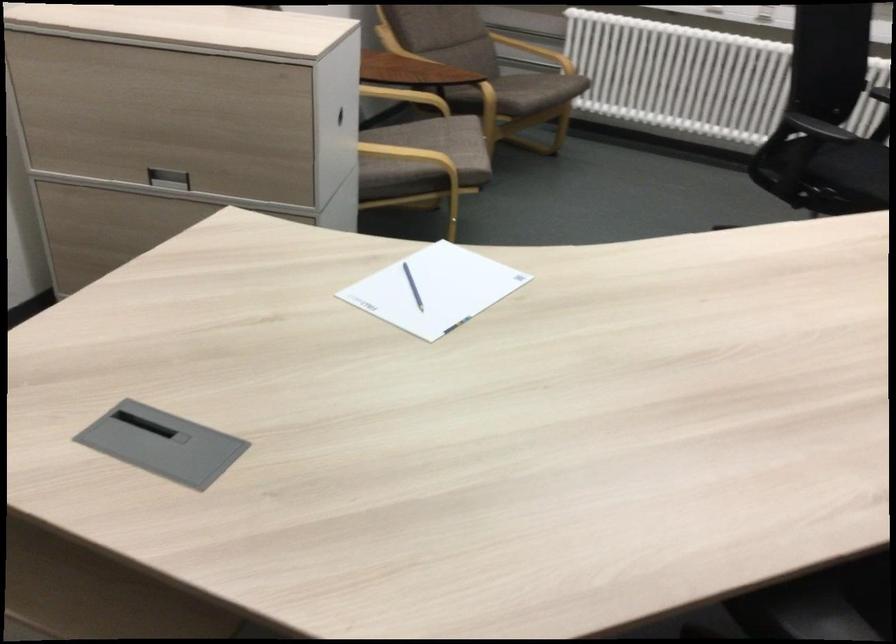
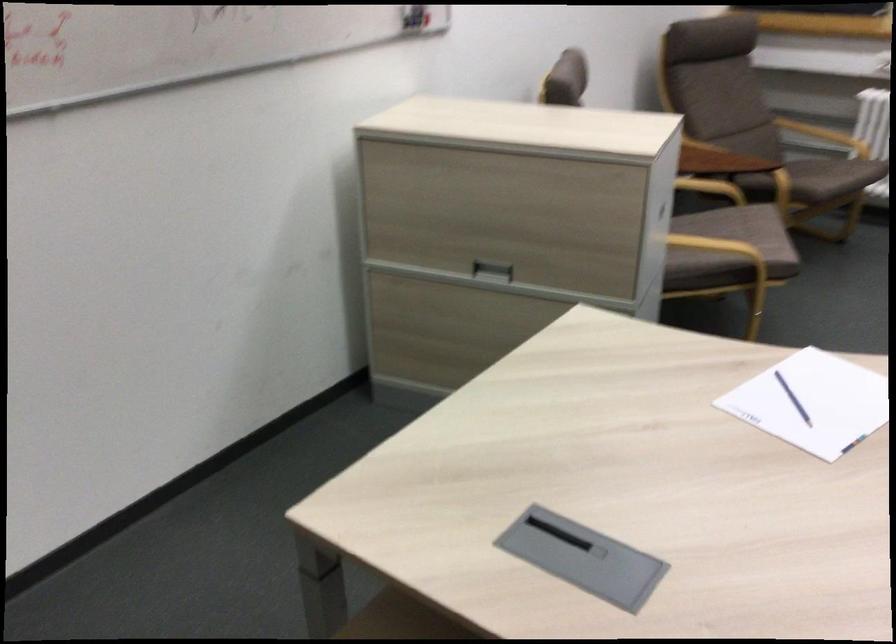
The point at (531,91) is marked in the first image. Where is the corresponding point in the second image?

(831, 176)